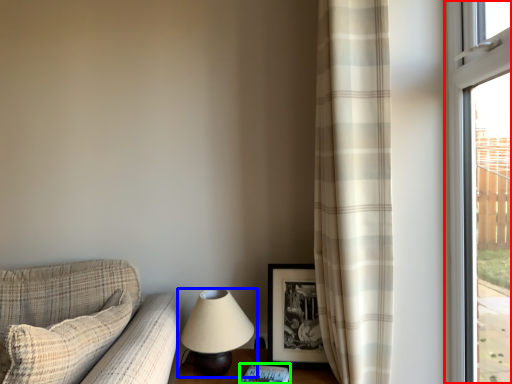
Question: Estimate the real-world distances between objects in this image. Which object is closer to window (highlighted by a red box), lamp (highlighted by a blue box) or book (highlighted by a green box)?

Choices:
 (A) lamp
 (B) book

Answer: (A)